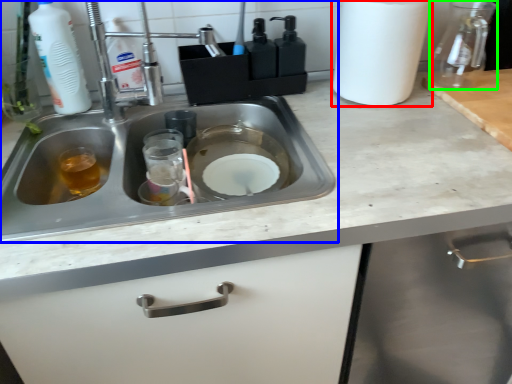
Question: Considering the real-world distances, which object is closest to paper towel (highlighted by a red box)? sink (highlighted by a blue box) or glass jar (highlighted by a green box).

Choices:
 (A) sink
 (B) glass jar

Answer: (B)